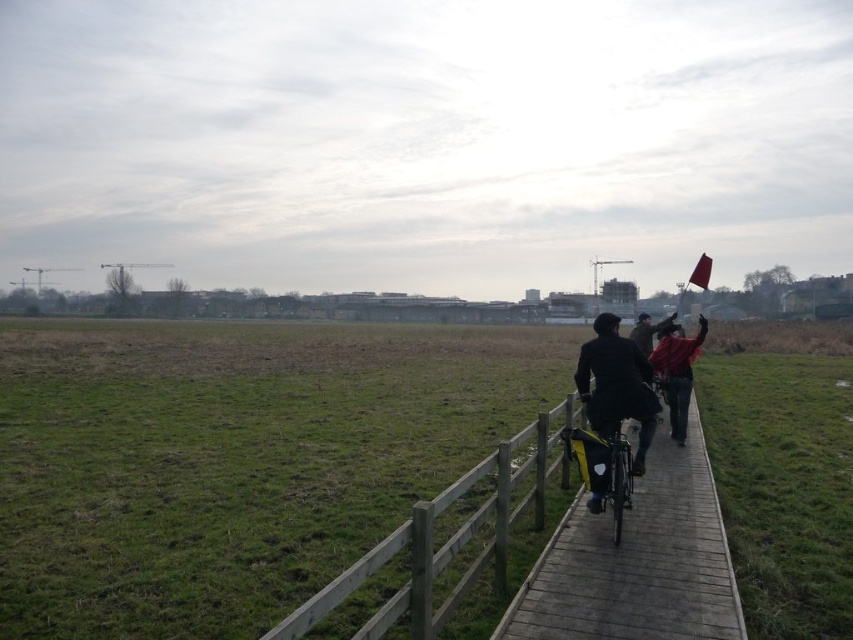
Question: Does green grass at lower left have a lesser width compared to wooden fence at center?

Choices:
 (A) yes
 (B) no

Answer: (B)

Question: Is wooden boardwalk at center positioned at the back of matte black jacket at center?

Choices:
 (A) yes
 (B) no

Answer: (B)

Question: Is wooden boardwalk at center below wooden fence at center?

Choices:
 (A) yes
 (B) no

Answer: (A)

Question: Which of these objects is positioned farthest from the red fabric flag at right?

Choices:
 (A) matte black jacket at center
 (B) wooden fence at center
 (C) shiny metallic bicycle at center
 (D) wooden boardwalk at center

Answer: (B)

Question: Which point is closer to the camera?

Choices:
 (A) green grass at lower left
 (B) matte black jacket at center

Answer: (A)

Question: Which point is closer to the camera taking this photo?

Choices:
 (A) click(683, 401)
 (B) click(679, 346)
 (C) click(490, 472)
 (D) click(643, 353)

Answer: (C)